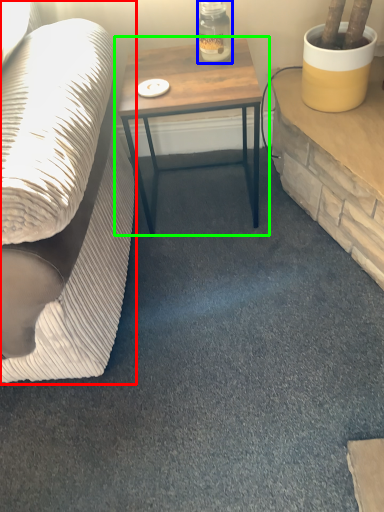
Question: Which object is the closest to the studio couch (highlighted by a red box)? Choose among these: bottle (highlighted by a blue box) or table (highlighted by a green box).

Choices:
 (A) bottle
 (B) table

Answer: (B)